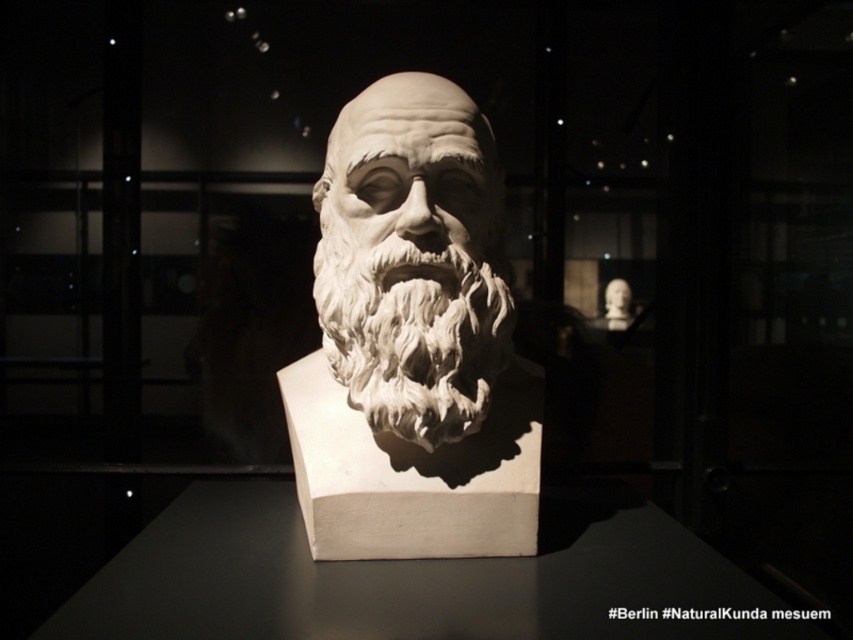
You are an art conservator examining the white marble bust at center and the white marble beard at center in the museum. Which object is positioned higher in the image?

The white marble bust at center is positioned higher than the white marble beard at center.

You are a museum curator planning to install a spotlight directly above the white marble bust at center. Given the current lighting setup, which casts shadows beneath it, will the new spotlight likely reduce or increase the shadow length of the bust?

→ The white marble bust at center is located at point (412, 340). Since the current lighting is from above and the new spotlight is also placed directly above, the shadow length will likely remain similar or slightly reduce if the spotlight is positioned closer. However, without exact placement details, it is hard to determine precisely. But based on the description, the shadow length might not increase significantly.